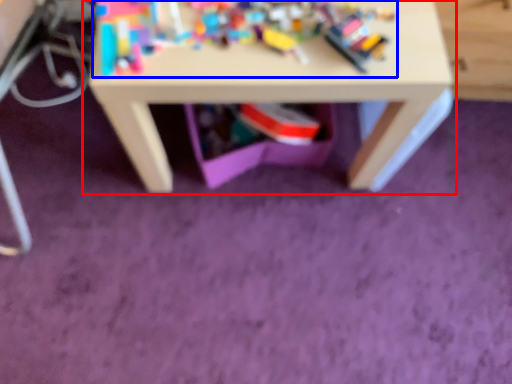
Question: Which point is closer to the camera, table (highlighted by a red box) or toy (highlighted by a blue box)?

Choices:
 (A) table
 (B) toy

Answer: (B)